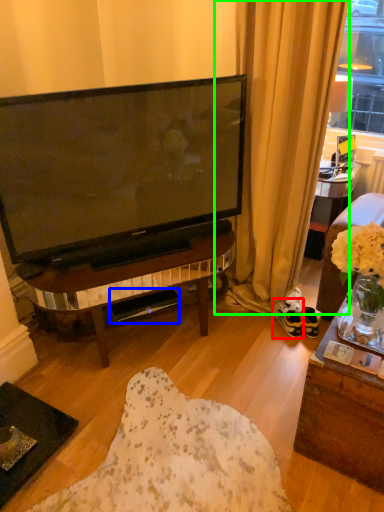
Question: Estimate the real-world distances between objects in this image. Which object is farther from footwear (highlighted by a red box), loudspeaker (highlighted by a blue box) or curtain (highlighted by a green box)?

Choices:
 (A) loudspeaker
 (B) curtain

Answer: (A)